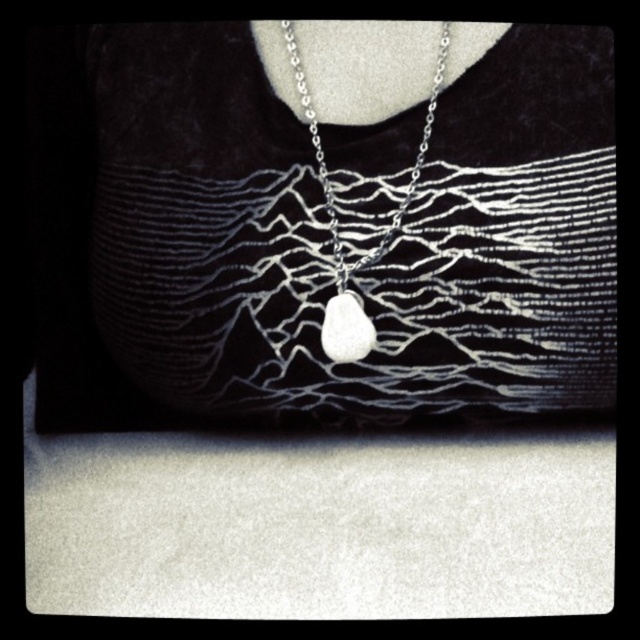
Locate an element on the screen. Image resolution: width=640 pixels, height=640 pixels. silver metallic necklace at center is located at coordinates (356, 214).

Does silver metallic necklace at center have a greater width compared to silver metallic pendant at center?

Yes, silver metallic necklace at center is wider than silver metallic pendant at center.

Which is in front, point (252, 294) or point (445, 36)?

Point (445, 36)

Identify the location of silver metallic necklace at center. The height and width of the screenshot is (640, 640). tap(356, 214).

Can you confirm if silver metallic necklace at center is taller than white matte stone at center?

Yes.

Locate an element on the screen. silver metallic necklace at center is located at coordinates (356, 214).

You are a GUI agent. You are given a task and a screenshot of the screen. Output one action in this format:
    pyautogui.click(x=<x>, y=<y>)
    Task: Click on the silver metallic necklace at center
    The height and width of the screenshot is (640, 640).
    Given the screenshot: What is the action you would take?
    pyautogui.click(x=356, y=214)

Between silver metallic pendant at center and white matte stone at center, which one has more height?

silver metallic pendant at center

Is point (369, 264) positioned in front of point (328, 305)?

Yes, it is in front of point (328, 305).

Which is in front, point (339, 304) or point (337, 360)?

Positioned in front is point (339, 304).

This screenshot has height=640, width=640. I want to click on silver metallic pendant at center, so pyautogui.click(x=337, y=221).